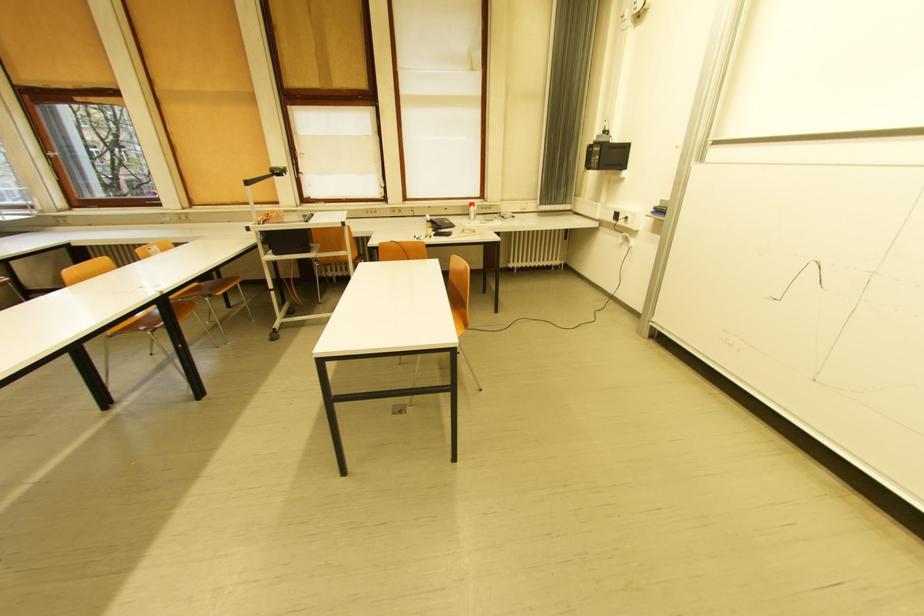
At what (x,y) coordinates should I click in order to perform the action: click on projector cart handle. Please return your answer as a coordinate pair (x, y). Looking at the image, I should click on (265, 176).